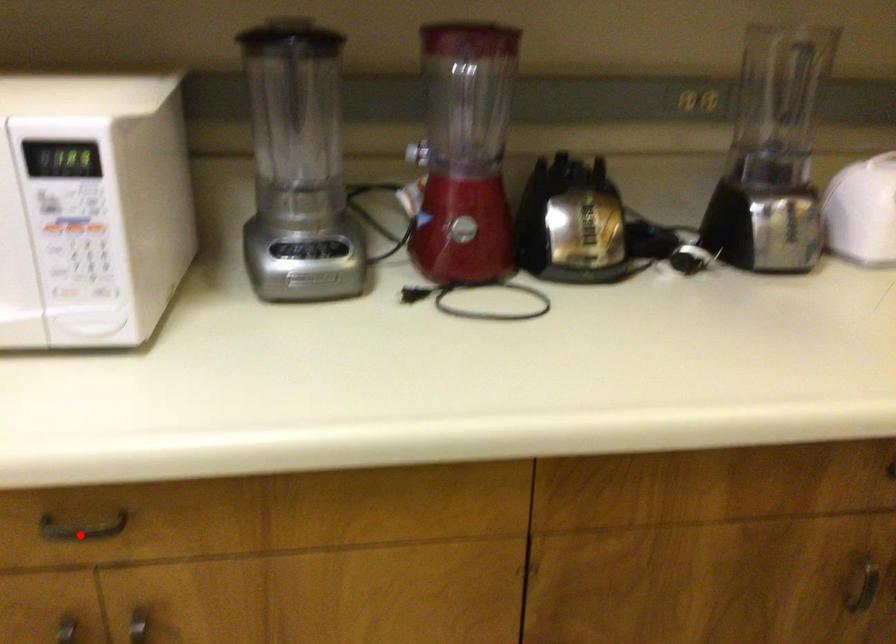
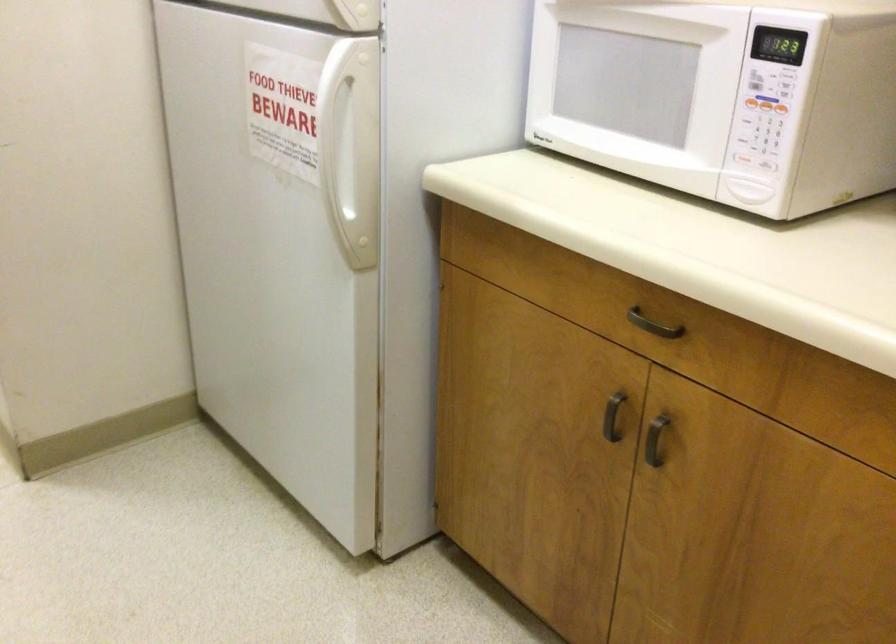
Locate, in the second image, the point that corresponds to the highlighted location in the first image.

(652, 325)